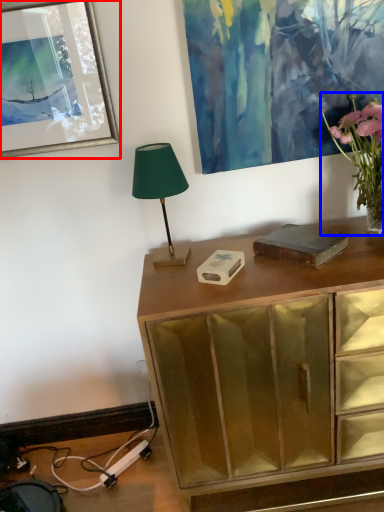
Question: Which object appears closest to the camera in this image, picture frame (highlighted by a red box) or houseplant (highlighted by a blue box)?

Choices:
 (A) picture frame
 (B) houseplant

Answer: (B)